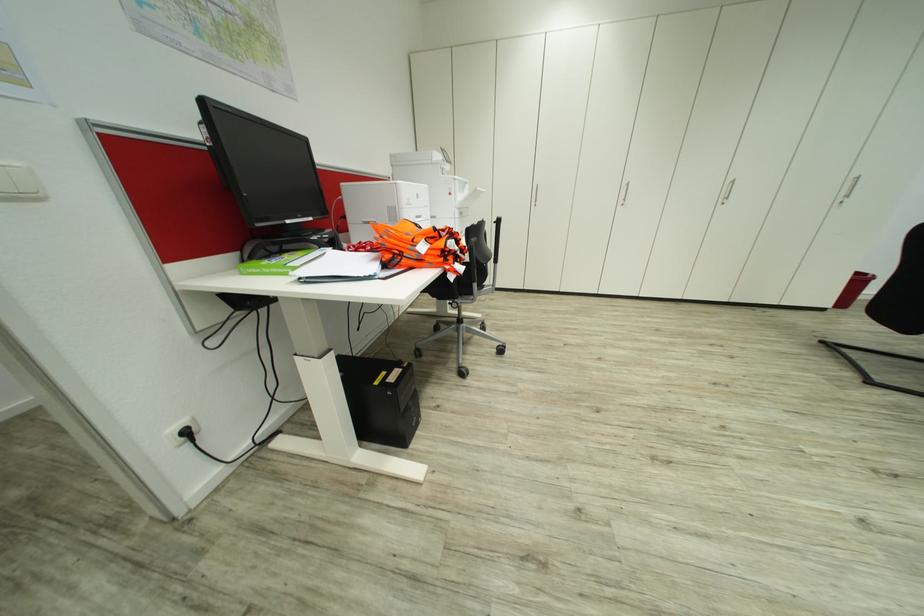
Find where to lift the green spine book. Please return your answer as a coordinate pair (x, y).

(274, 262)